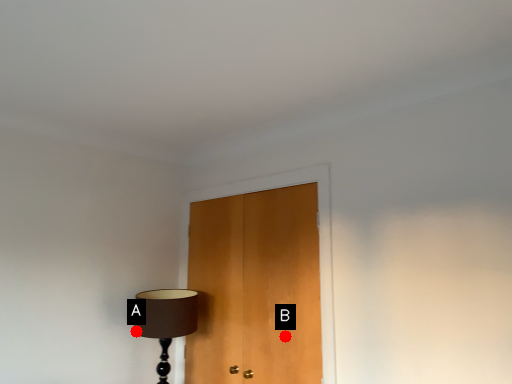
Question: Two points are circled on the image, labeled by A and B beside each circle. Which of the following is the farthest from the observer?

Choices:
 (A) A is further
 (B) B is further

Answer: (A)